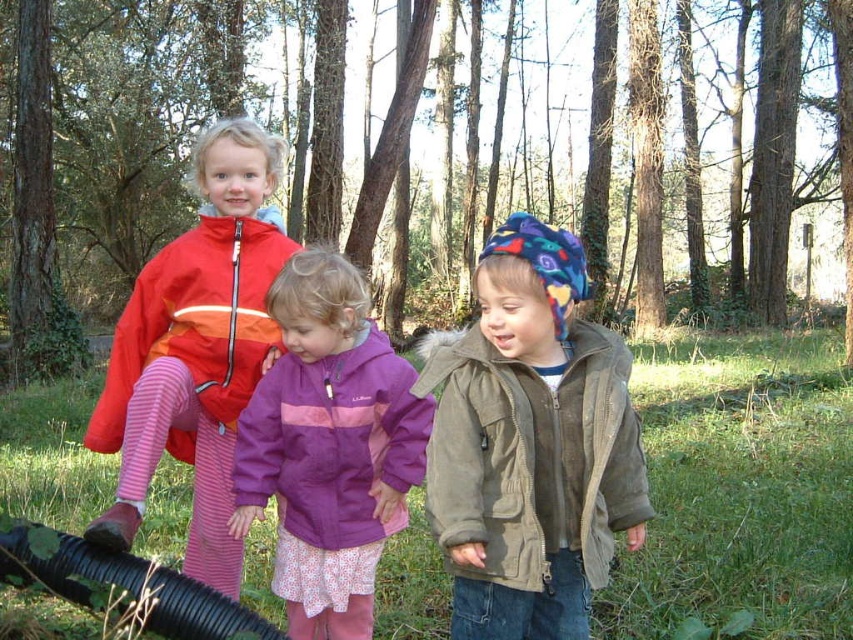
Is the position of purple matte jacket at center less distant than that of suede jacket at center?

No.

Between point (280, 452) and point (585, 417), which one is positioned in front?

Point (585, 417) is in front.

The width and height of the screenshot is (853, 640). I want to click on purple matte jacket at center, so click(329, 445).

Locate an element on the screen. This screenshot has height=640, width=853. purple matte jacket at center is located at coordinates (329, 445).

Can you confirm if suede jacket at center is positioned above black rubber garden hose at lower left?

Correct, suede jacket at center is located above black rubber garden hose at lower left.

Can you confirm if suede jacket at center is positioned to the right of black rubber garden hose at lower left?

Indeed, suede jacket at center is positioned on the right side of black rubber garden hose at lower left.

The width and height of the screenshot is (853, 640). Identify the location of suede jacket at center. (531, 454).

Which is more to the left, matte red jacket at left or suede jacket at center?

matte red jacket at left is more to the left.

Does point (113, 444) come farther from viewer compared to point (454, 422)?

Yes, point (113, 444) is behind point (454, 422).

You are a GUI agent. You are given a task and a screenshot of the screen. Output one action in this format:
    pyautogui.click(x=<x>, y=<y>)
    Task: Click on the matte red jacket at left
    
    Given the screenshot: What is the action you would take?
    pyautogui.click(x=196, y=349)